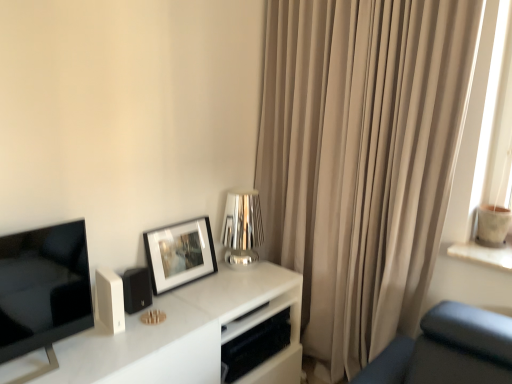
Question: From a real-world perspective, is beige fabric curtain at right under matte black speaker at lower left?

Choices:
 (A) yes
 (B) no

Answer: (B)

Question: Would you say beige fabric curtain at right is outside matte black speaker at lower left?

Choices:
 (A) no
 (B) yes

Answer: (B)

Question: Does beige fabric curtain at right appear on the right side of matte black speaker at lower left?

Choices:
 (A) no
 (B) yes

Answer: (B)

Question: Are beige fabric curtain at right and matte black speaker at lower left located far from each other?

Choices:
 (A) yes
 (B) no

Answer: (A)

Question: From a real-world perspective, is beige fabric curtain at right on top of matte black speaker at lower left?

Choices:
 (A) no
 (B) yes

Answer: (B)

Question: Is beige fabric curtain at right bigger than matte black speaker at lower left?

Choices:
 (A) yes
 (B) no

Answer: (A)

Question: Does beige fabric curtain at right turn towards white marble tv stand at center?

Choices:
 (A) yes
 (B) no

Answer: (A)

Question: From a real-world perspective, does beige fabric curtain at right stand above white marble tv stand at center?

Choices:
 (A) no
 (B) yes

Answer: (B)

Question: Considering the relative sizes of beige fabric curtain at right and white marble tv stand at center in the image provided, is beige fabric curtain at right smaller than white marble tv stand at center?

Choices:
 (A) no
 (B) yes

Answer: (A)

Question: From the image's perspective, would you say beige fabric curtain at right is shown under white marble tv stand at center?

Choices:
 (A) yes
 (B) no

Answer: (B)

Question: Does beige fabric curtain at right have a lesser width compared to white marble tv stand at center?

Choices:
 (A) yes
 (B) no

Answer: (A)

Question: Is beige fabric curtain at right to the right of white marble tv stand at center from the viewer's perspective?

Choices:
 (A) no
 (B) yes

Answer: (B)

Question: Is the position of shiny metallic table lamp at center more distant than that of white marble tv stand at center?

Choices:
 (A) no
 (B) yes

Answer: (B)